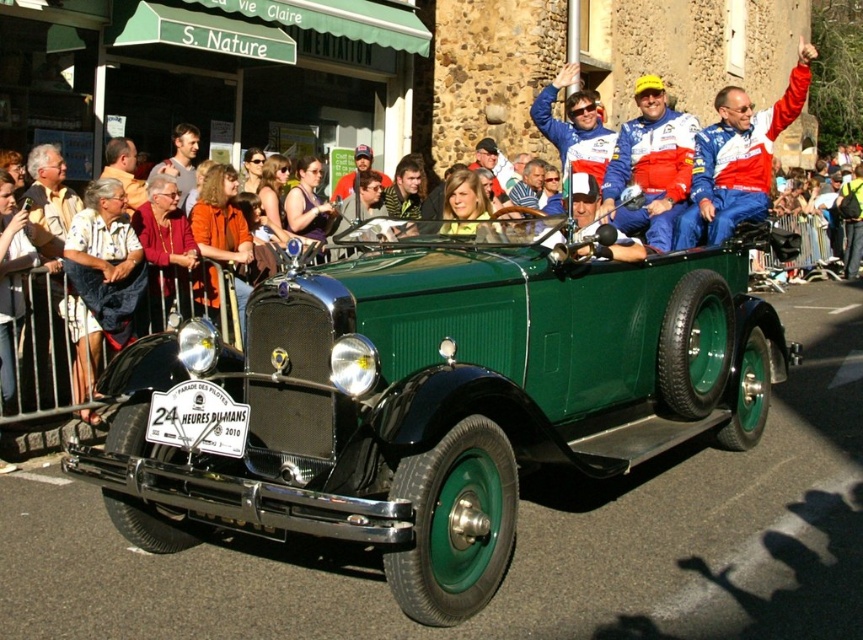
Does red and white racing suit at center appear under matte orange shirt at left?

No.

Does point (715, 104) lie behind point (123, 138)?

That is False.

Is point (700, 144) positioned after point (126, 177)?

No, (700, 144) is in front of (126, 177).

Identify the location of red and white racing suit at center. (736, 160).

Is green matte vintage car at center to the left of red and white racing suit at center from the viewer's perspective?

Indeed, green matte vintage car at center is positioned on the left side of red and white racing suit at center.

Which is more to the right, green matte vintage car at center or red and white racing suit at center?

From the viewer's perspective, red and white racing suit at center appears more on the right side.

This screenshot has width=863, height=640. Find the location of `green matte vintage car at center`. green matte vintage car at center is located at coordinates (433, 397).

Can you confirm if red and white racing suit at center is positioned below matte orange shirt at upper center?

No, red and white racing suit at center is not below matte orange shirt at upper center.

Looking at this image, does red and white racing suit at center come behind matte orange shirt at upper center?

No, red and white racing suit at center is closer to the viewer.

Who is more distant from viewer, (691, 179) or (186, 196)?

Positioned behind is point (186, 196).

Where is `red and white racing suit at center`? red and white racing suit at center is located at coordinates (736, 160).